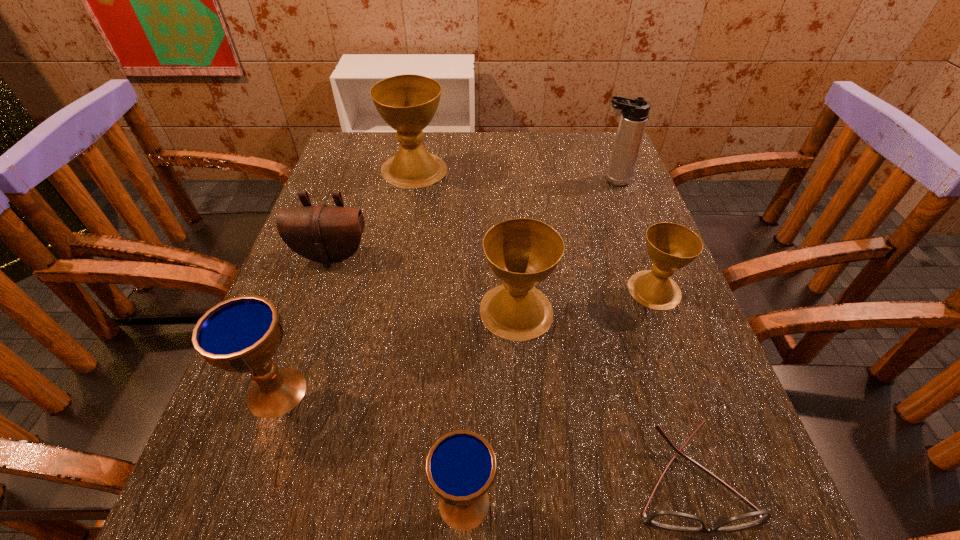
Choose which object is the sixth nearest neighbor to the second brown chalice from right to left. Please provide its 2D coordinates. Your answer should be formatted as a tuple, i.e. [(x, y)], where the tuple contains the x and y coordinates of a point satisfying the conditions above.

[(407, 103)]

You are a GUI agent. You are given a task and a screenshot of the screen. Output one action in this format:
    pyautogui.click(x=<x>, y=<y>)
    Task: Click on the chalice that stands as the closest to the second brown chalice from right to left
    
    Given the screenshot: What is the action you would take?
    pyautogui.click(x=670, y=246)

Choose which chalice is the fourth nearest neighbor to the second biggest brown chalice. Please provide its 2D coordinates. Your answer should be formatted as a tuple, i.e. [(x, y)], where the tuple contains the x and y coordinates of a point satisfying the conditions above.

[(407, 103)]

Where is `brown chalice that is the closest one to the rightmost chalice`? The width and height of the screenshot is (960, 540). brown chalice that is the closest one to the rightmost chalice is located at coordinates (522, 252).

You are a GUI agent. You are given a task and a screenshot of the screen. Output one action in this format:
    pyautogui.click(x=<x>, y=<y>)
    Task: Click on the brown chalice that can be found as the third closest to the spectacles
    This screenshot has width=960, height=540.
    Given the screenshot: What is the action you would take?
    pyautogui.click(x=407, y=103)

You are a GUI agent. You are given a task and a screenshot of the screen. Output one action in this format:
    pyautogui.click(x=<x>, y=<y>)
    Task: Click on the vacant space that satisfies the following two spatial constraints: 1. with the flap open on the brown pouch; 2. on the right side of the second biggest brown chalice
    
    Given the screenshot: What is the action you would take?
    pyautogui.click(x=313, y=311)

Locate an element on the screen. This screenshot has height=540, width=960. free space that satisfies the following two spatial constraints: 1. on the handle side of the rightmost chalice; 2. on the left side of the thermos bottle is located at coordinates (653, 290).

This screenshot has height=540, width=960. I want to click on vacant position in the image that satisfies the following two spatial constraints: 1. with the flap open on the brown pouch; 2. on the right side of the second brown chalice from left to right, so click(313, 311).

Where is `free spot that satisfies the following two spatial constraints: 1. on the handle side of the thermos bottle; 2. with the flap open on the brown pouch`? The width and height of the screenshot is (960, 540). free spot that satisfies the following two spatial constraints: 1. on the handle side of the thermos bottle; 2. with the flap open on the brown pouch is located at coordinates (640, 256).